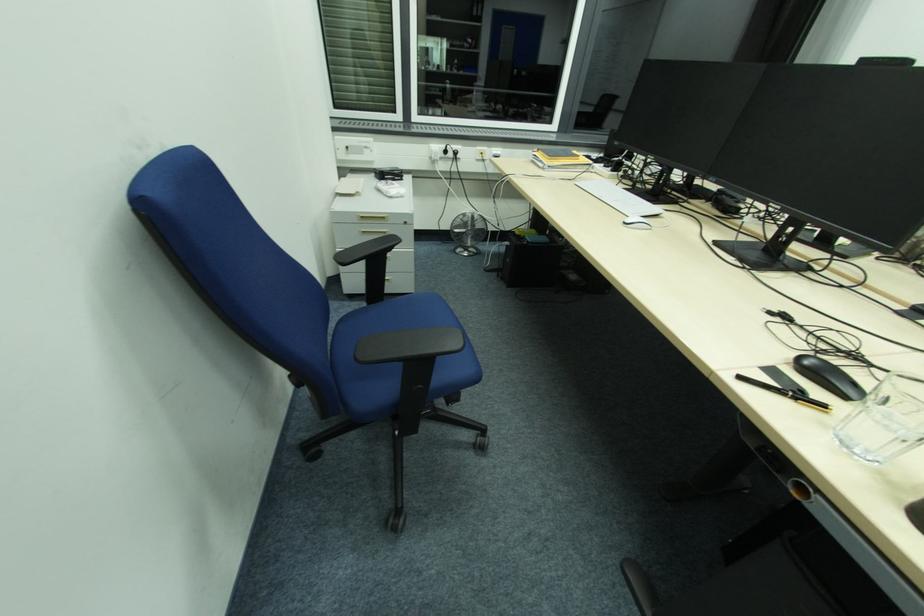
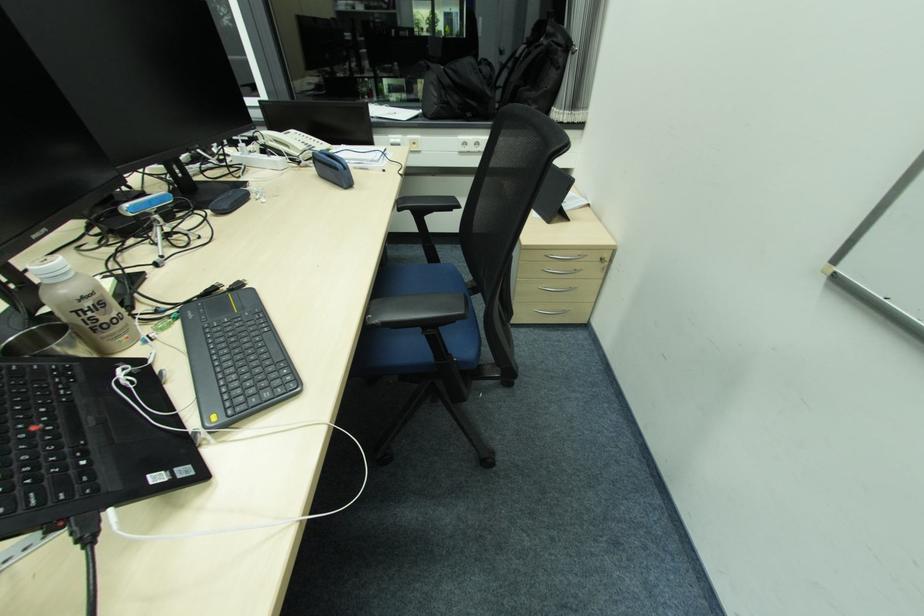
Question: The images are taken continuously from a first-person perspective. In which direction are you moving?

Choices:
 (A) Left
 (B) Right
 (C) Forward
 (D) Backward

Answer: (B)